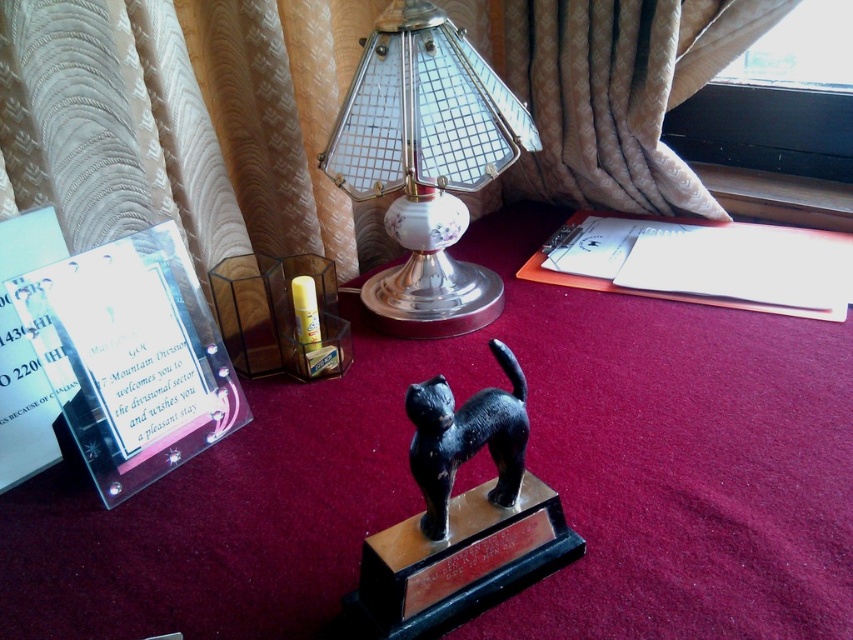
Which of these two, metallic trophy at center or metallic glass lampshade at center, stands shorter?

metallic glass lampshade at center

Does metallic trophy at center have a smaller size compared to metallic glass lampshade at center?

Actually, metallic trophy at center might be larger than metallic glass lampshade at center.

Does point (282, 429) lie in front of point (410, 326)?

Yes, it is.

I want to click on metallic trophy at center, so click(x=526, y=465).

Between metallic trophy at center and black glossy cat at center, which one appears on the left side from the viewer's perspective?

Positioned to the left is black glossy cat at center.

Does point (753, 481) lie behind point (440, 515)?

That is True.

This screenshot has width=853, height=640. Identify the location of metallic trophy at center. (526, 465).

Based on the photo, is metallic glass lampshade at center above black glossy cat at center?

Yes.

Looking at this image, how far apart are metallic glass lampshade at center and black glossy cat at center?

A distance of 17.69 inches exists between metallic glass lampshade at center and black glossy cat at center.

Which is in front, point (392, 323) or point (514, 502)?

Point (514, 502) is in front.

I want to click on metallic glass lampshade at center, so pyautogui.click(x=426, y=164).